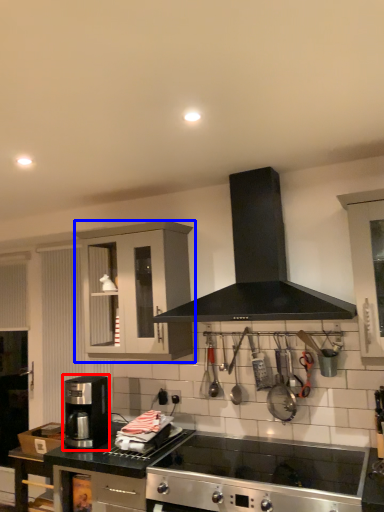
Question: Which of the following is the farthest to the observer, coffee maker (highlighted by a red box) or cabinetry (highlighted by a blue box)?

Choices:
 (A) coffee maker
 (B) cabinetry

Answer: (B)